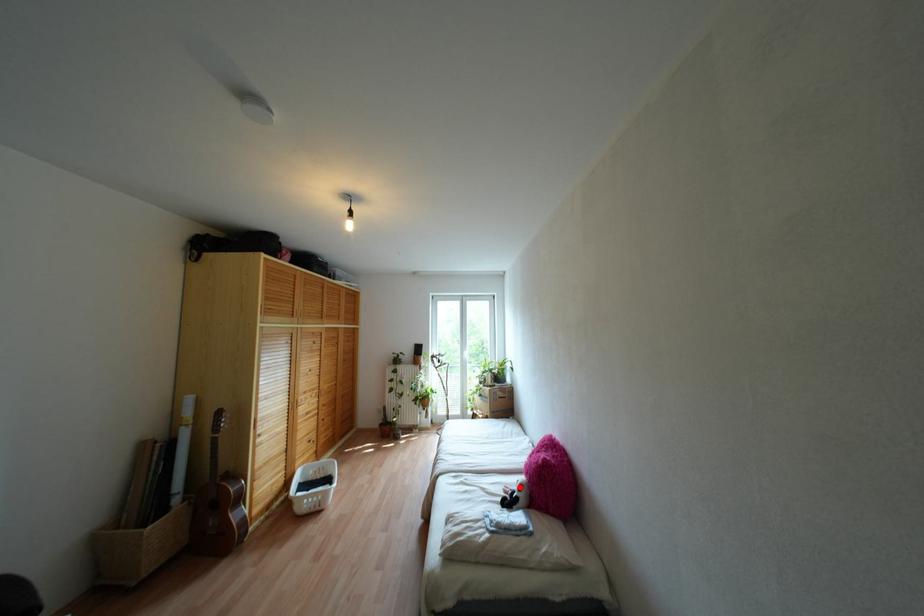
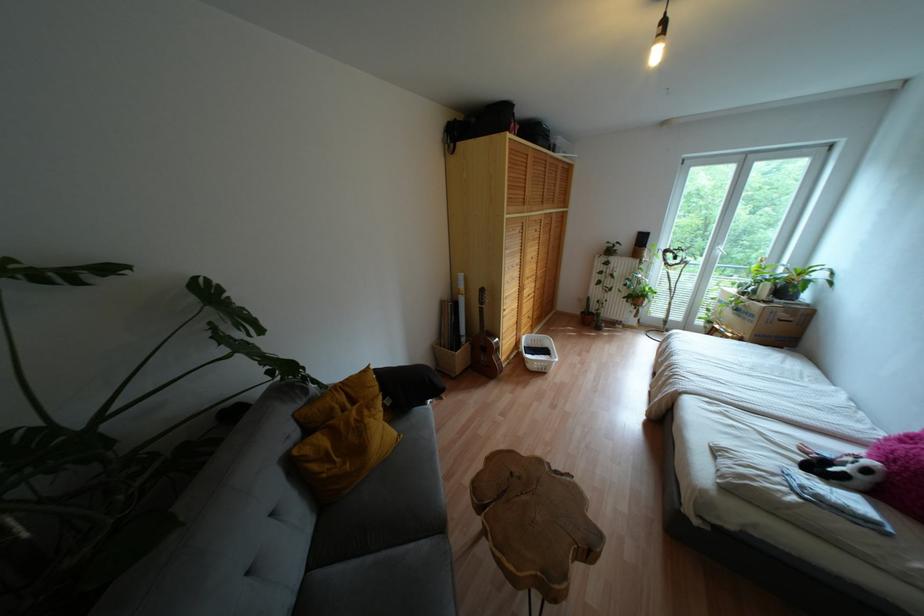
Question: I am providing you with two images of the same scene from different viewpoints. A red point is shown in image1. For the corresponding object point in image2, is it positioned nearer or farther from the camera?

Choices:
 (A) Nearer
 (B) Farther

Answer: (B)